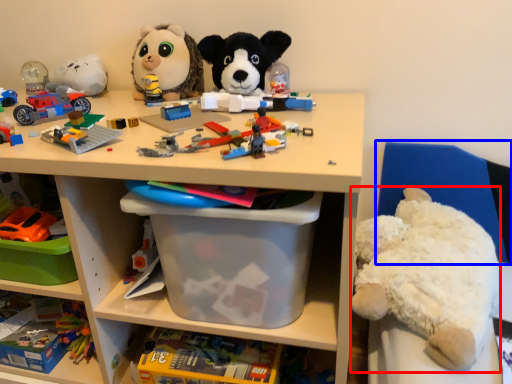
Question: Which point is further to the camera, teddy bear (highlighted by a red box) or chair (highlighted by a blue box)?

Choices:
 (A) teddy bear
 (B) chair

Answer: (B)